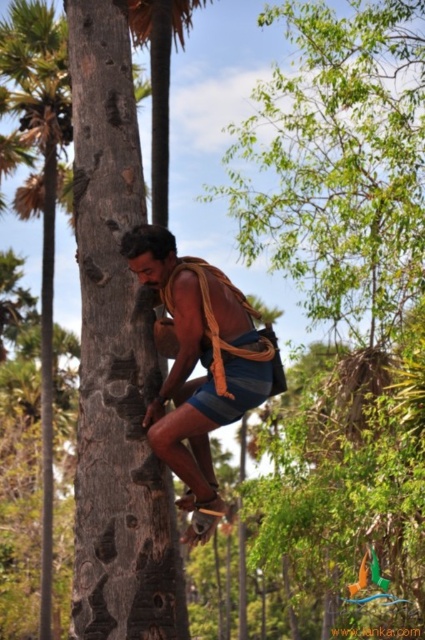
From the picture: Who is higher up, smooth brown tree trunk at center or blue striped shorts at center?

Positioned higher is smooth brown tree trunk at center.

What do you see at coordinates (115, 356) in the screenshot? This screenshot has height=640, width=425. I see `smooth brown tree trunk at center` at bounding box center [115, 356].

Is point (105, 499) positioned in front of point (192, 468)?

Yes, it is.

You are a GUI agent. You are given a task and a screenshot of the screen. Output one action in this format:
    pyautogui.click(x=<x>, y=<y>)
    Task: Click on the smooth brown tree trunk at center
    
    Given the screenshot: What is the action you would take?
    point(115,356)

Describe the element at coordinates (195, 364) in the screenshot. I see `blue striped shorts at center` at that location.

Is blue striped shorts at center smaller than brown wood palm tree at left?

Yes.

What do you see at coordinates (195, 364) in the screenshot? I see `blue striped shorts at center` at bounding box center [195, 364].

The height and width of the screenshot is (640, 425). I want to click on blue striped shorts at center, so click(195, 364).

Does smooth brown tree trunk at center appear over brown wood palm tree at left?

Indeed, smooth brown tree trunk at center is positioned over brown wood palm tree at left.

Between smooth brown tree trunk at center and brown wood palm tree at left, which one appears on the right side from the viewer's perspective?

Positioned to the right is smooth brown tree trunk at center.

Who is more distant from viewer, (x=110, y=180) or (x=47, y=573)?

Point (x=47, y=573)

I want to click on smooth brown tree trunk at center, so click(x=115, y=356).